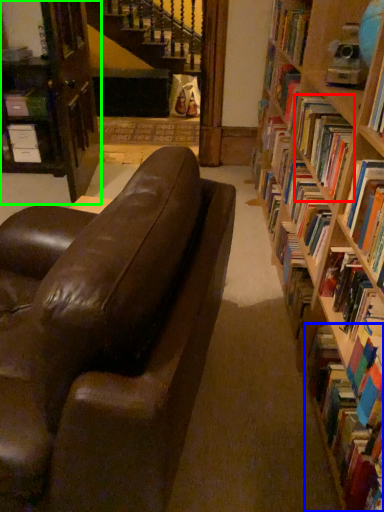
Question: Which object is positioned farthest from book (highlighted by a red box)? Select from book (highlighted by a blue box) and bookcase (highlighted by a green box).

Choices:
 (A) book
 (B) bookcase

Answer: (B)